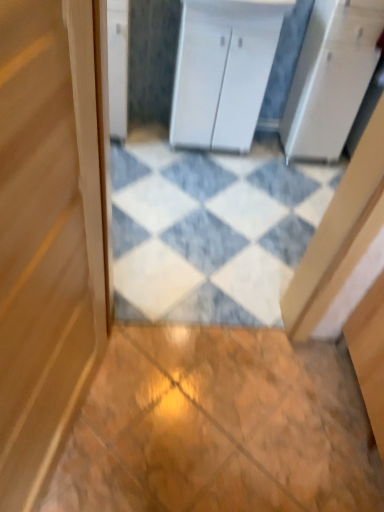
Locate an element on the screen. This screenshot has width=384, height=512. free region under wooden door at center (from a real-world perspective) is located at coordinates (77, 432).